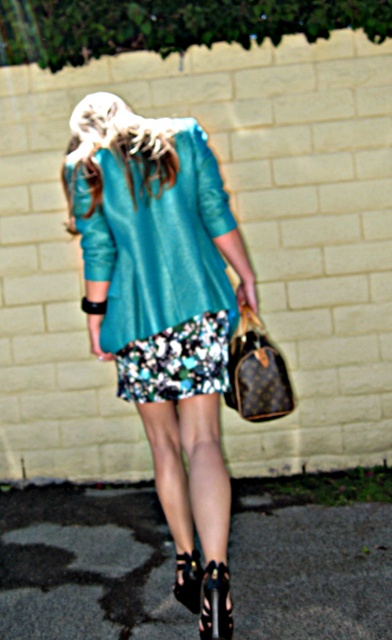
You are a fashion designer observing the outfit of the person in the image. You need to determine which item, the brown leather handbag at lower center or the black leather sandal at lower center, is taller. Based on the description provided, which one is taller?

The brown leather handbag at lower center is taller than the black leather sandal at lower center according to the description.

Based on the coordinates provided, where is the floral printed skirt at center located in the image?

The floral printed skirt at center is located at the 2D coordinates point of (177, 360).

You are a photographer trying to capture the scene. You notice the black asphalt pavement at lower center and the brown leather handbag at lower center. Which object is located to the left of the other?

The black asphalt pavement at lower center is positioned on the left side of brown leather handbag at lower center.